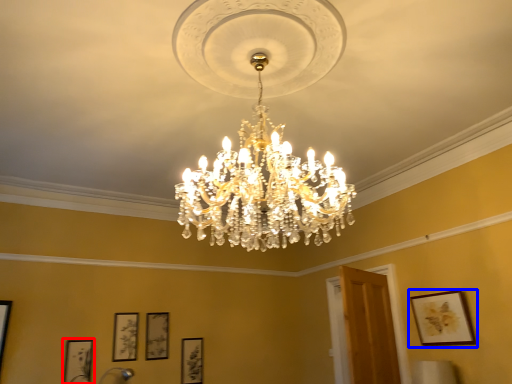
Question: Which object appears closest to the camera in this image, picture frame (highlighted by a red box) or picture frame (highlighted by a blue box)?

Choices:
 (A) picture frame
 (B) picture frame

Answer: (B)